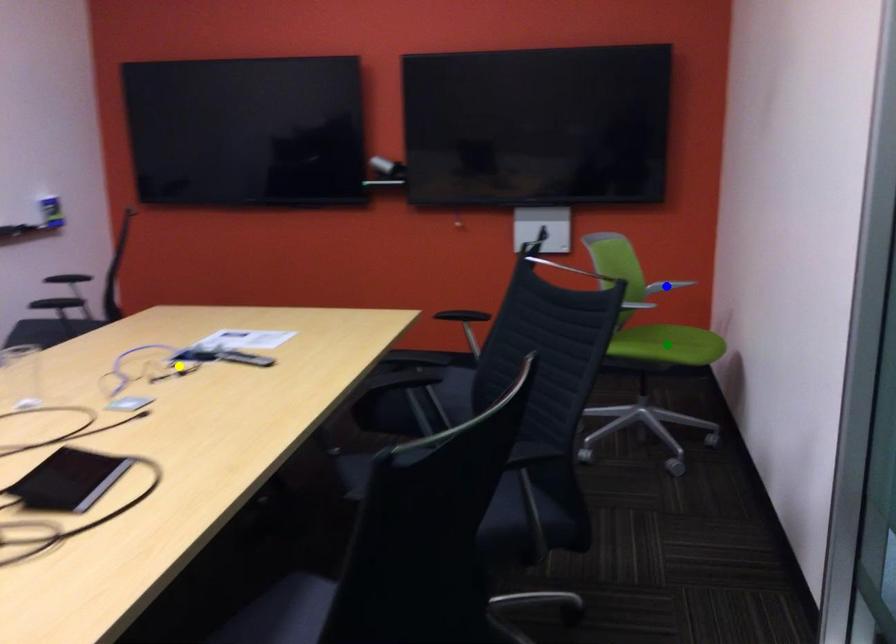
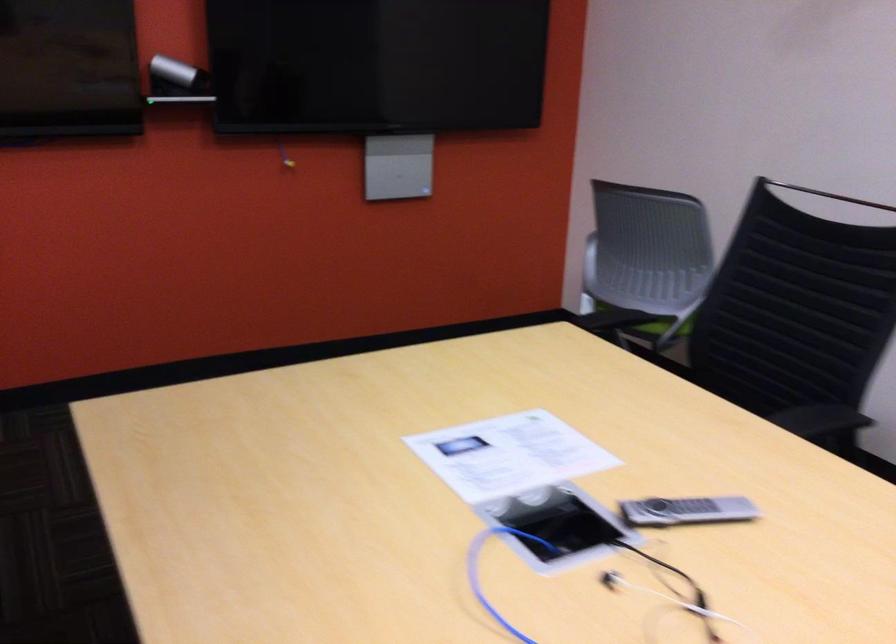
I am providing you with two images of the same scene from different viewpoints. Three points are marked in image1. Which point corresponds to a part or object that is occluded in image2?In image1, three points are marked. Which of them correspond to a part or object that is occluded in image2?Among the three points shown in image1, which one corresponds to a part or object that is no longer visible due to occlusion in image2?

green point, blue point